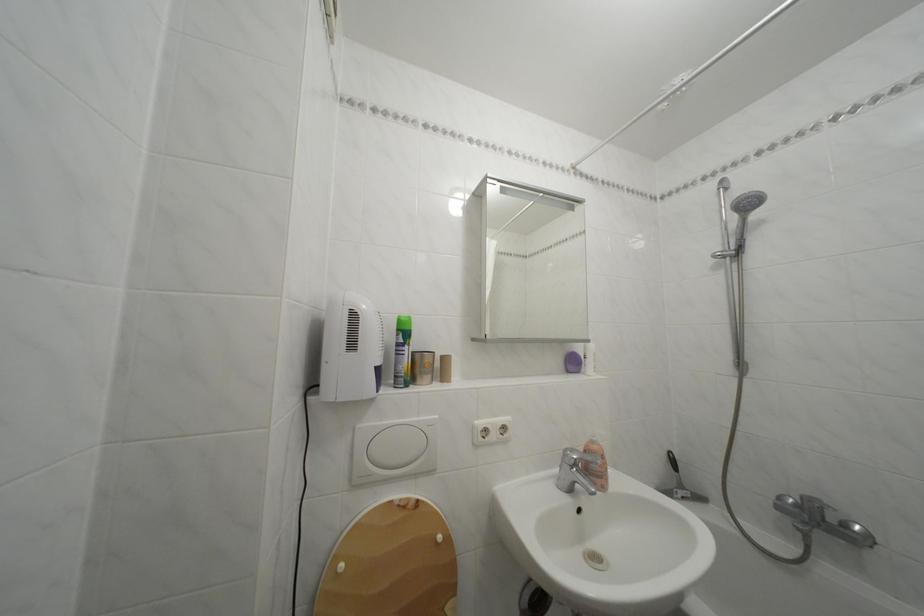
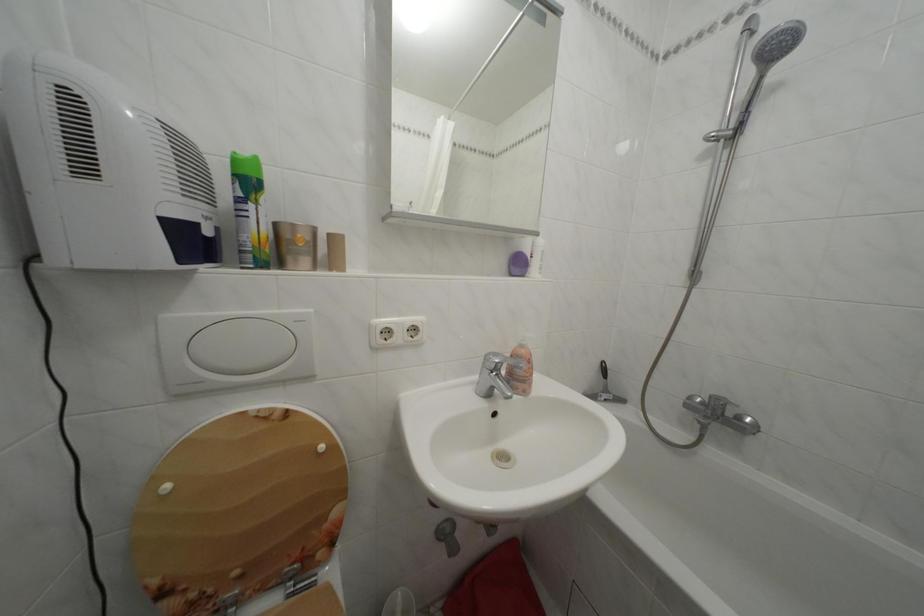
Where in the second image is the point corresponding to the point at 582,369 from the first image?

(527, 270)